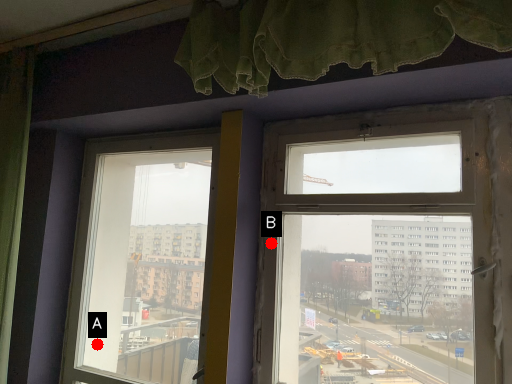
Question: Two points are circled on the image, labeled by A and B beside each circle. Which of the following is the closest to the observer?

Choices:
 (A) A is closer
 (B) B is closer

Answer: (B)